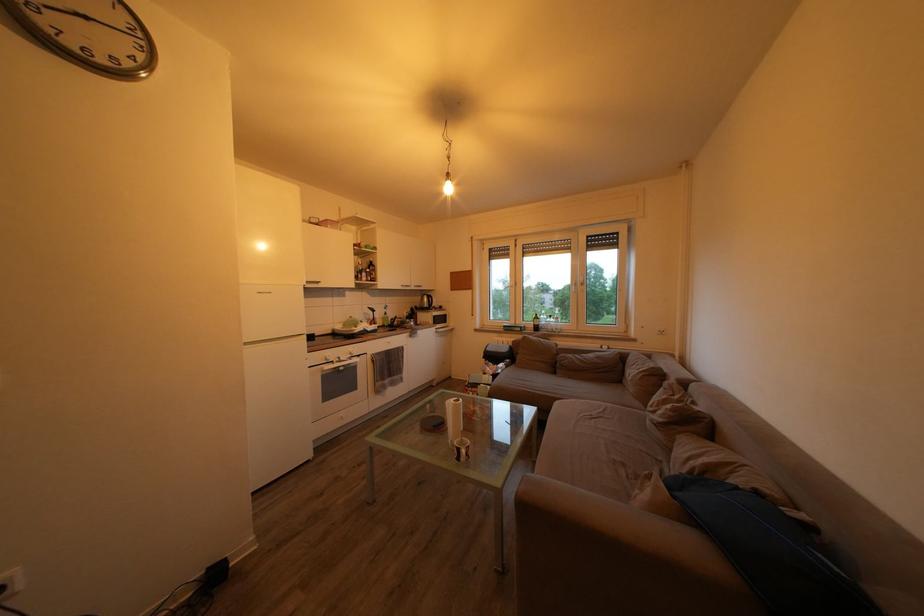
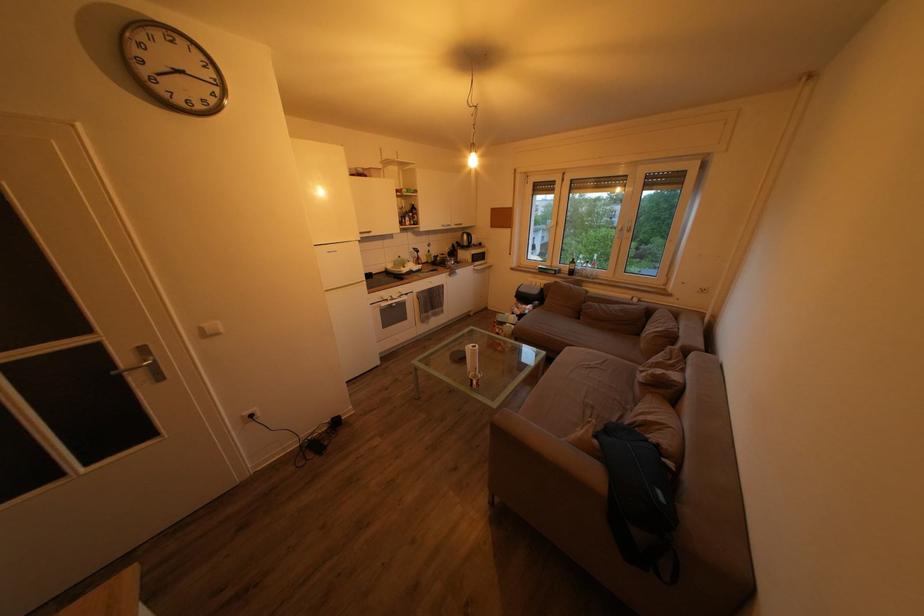
Locate, in the second image, the point that corresponds to [630,363] in the first image.

(657, 318)